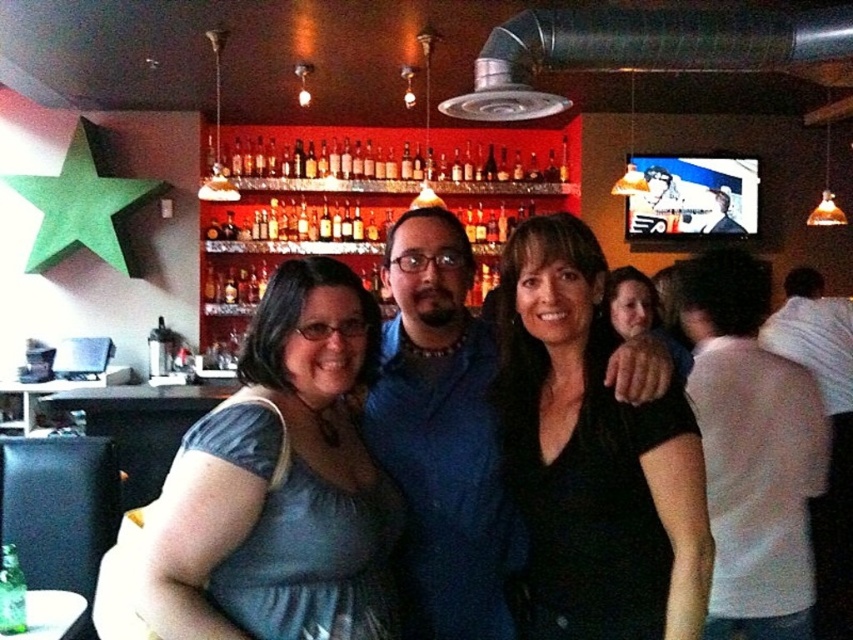
Is point (813, 404) in front of point (323, 157)?

Yes, point (813, 404) is closer to viewer.

Describe the element at coordinates (752, 449) in the screenshot. This screenshot has height=640, width=853. I see `white cotton shirt at right` at that location.

Describe the element at coordinates (752, 449) in the screenshot. The image size is (853, 640). I see `white cotton shirt at right` at that location.

Image resolution: width=853 pixels, height=640 pixels. What are the coordinates of `white cotton shirt at right` in the screenshot? It's located at (752, 449).

Can you confirm if shiny blue dress at center is taller than translucent glass bottles at center?

Yes, shiny blue dress at center is taller than translucent glass bottles at center.

The width and height of the screenshot is (853, 640). What are the coordinates of `shiny blue dress at center` in the screenshot? It's located at (280, 484).

Between shiny blue dress at center and white cotton shirt at right, which one appears on the left side from the viewer's perspective?

From the viewer's perspective, shiny blue dress at center appears more on the left side.

Describe the element at coordinates (280, 484) in the screenshot. I see `shiny blue dress at center` at that location.

What do you see at coordinates (280, 484) in the screenshot?
I see `shiny blue dress at center` at bounding box center [280, 484].

Image resolution: width=853 pixels, height=640 pixels. What are the coordinates of `shiny blue dress at center` in the screenshot? It's located at (280, 484).